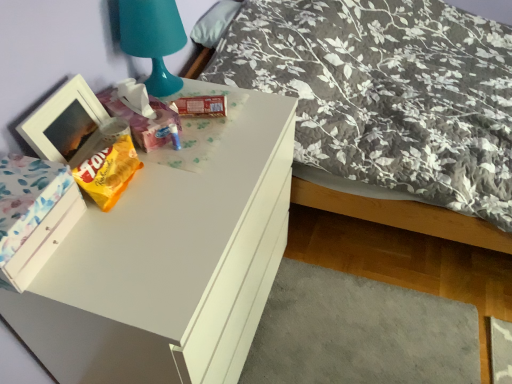
Question: From a real-world perspective, is white painted wood drawer at lower left under matte plastic tissue box at upper center, which is the 1th package in left-to-right order?

Choices:
 (A) no
 (B) yes

Answer: (B)

Question: Considering the relative sizes of white painted wood drawer at lower left and matte plastic tissue box at upper center, the 2th package from the right, in the image provided, is white painted wood drawer at lower left bigger than matte plastic tissue box at upper center, the 2th package from the right,?

Choices:
 (A) no
 (B) yes

Answer: (B)

Question: Does white painted wood drawer at lower left have a greater height compared to matte plastic tissue box at upper center, the 2th package from the right?

Choices:
 (A) yes
 (B) no

Answer: (B)

Question: Is white painted wood drawer at lower left outside of matte plastic tissue box at upper center, the 2th package from the right?

Choices:
 (A) yes
 (B) no

Answer: (A)

Question: Does white painted wood drawer at lower left have a greater width compared to matte plastic tissue box at upper center, which is the 1th package in left-to-right order?

Choices:
 (A) yes
 (B) no

Answer: (B)

Question: Is point (160, 374) positioned closer to the camera than point (206, 13)?

Choices:
 (A) farther
 (B) closer

Answer: (B)

Question: Considering the relative positions of white glossy desk at upper left and fluffy gray pillow at upper center in the image provided, is white glossy desk at upper left to the left or to the right of fluffy gray pillow at upper center?

Choices:
 (A) left
 (B) right

Answer: (A)

Question: From the image's perspective, relative to fluffy gray pillow at upper center, is white glossy desk at upper left above or below?

Choices:
 (A) below
 (B) above

Answer: (A)

Question: In terms of height, does white glossy desk at upper left look taller or shorter compared to fluffy gray pillow at upper center?

Choices:
 (A) short
 (B) tall

Answer: (B)

Question: From the image's perspective, is floral fabric bed at upper right above or below teal plastic table lamp at upper left?

Choices:
 (A) above
 (B) below

Answer: (A)

Question: Which is correct: floral fabric bed at upper right is inside teal plastic table lamp at upper left, or outside of it?

Choices:
 (A) inside
 (B) outside

Answer: (B)

Question: Is point (479, 223) positioned closer to the camera than point (135, 0)?

Choices:
 (A) closer
 (B) farther

Answer: (B)

Question: Is floral fabric bed at upper right taller or shorter than teal plastic table lamp at upper left?

Choices:
 (A) tall
 (B) short

Answer: (A)

Question: In terms of size, does matte plastic tissue box at upper center, which is the 1th package in left-to-right order, appear bigger or smaller than floral fabric bed at upper right?

Choices:
 (A) small
 (B) big

Answer: (A)

Question: Considering their positions, is matte plastic tissue box at upper center, which is the 1th package in left-to-right order, located in front of or behind floral fabric bed at upper right?

Choices:
 (A) behind
 (B) front

Answer: (A)